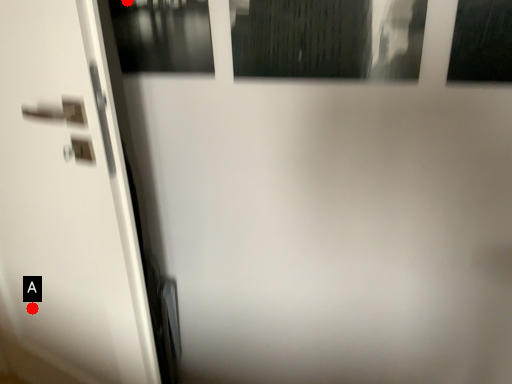
Question: Two points are circled on the image, labeled by A and B beside each circle. Which point is closer to the camera?

Choices:
 (A) A is closer
 (B) B is closer

Answer: (B)